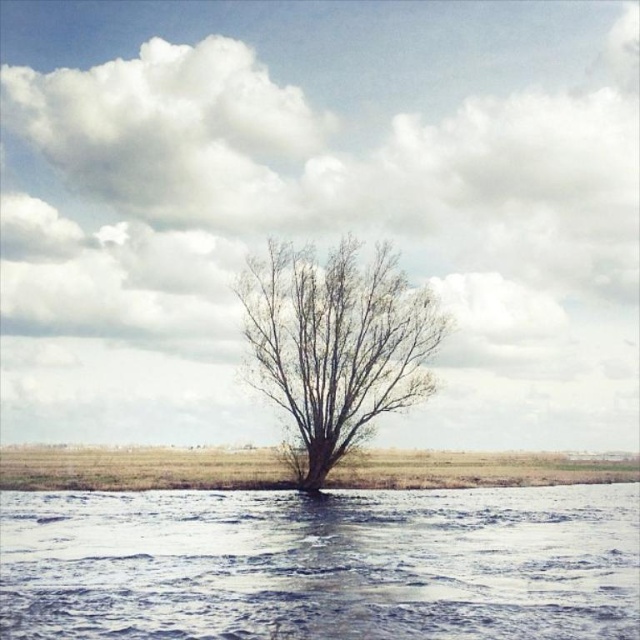
Question: Where is translucent ice at lower center located in relation to brown grass at center in the image?

Choices:
 (A) below
 (B) above

Answer: (B)

Question: Which point is farther from the camera taking this photo?

Choices:
 (A) (x=161, y=568)
 (B) (x=305, y=410)

Answer: (B)

Question: Which object appears farthest from the camera in this image?

Choices:
 (A) translucent ice at lower center
 (B) brown grass at center

Answer: (B)

Question: Which of these objects is positioned farthest from the brown grass at center?

Choices:
 (A) translucent ice at lower center
 (B) bare branches at center

Answer: (A)

Question: Does translucent ice at lower center have a greater width compared to brown grass at center?

Choices:
 (A) yes
 (B) no

Answer: (B)

Question: Is translucent ice at lower center above brown grass at center?

Choices:
 (A) yes
 (B) no

Answer: (A)